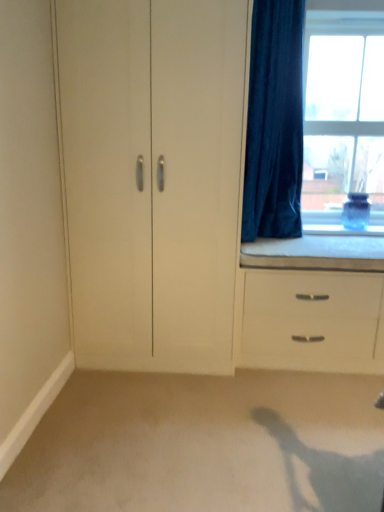
This screenshot has height=512, width=384. Identify the location of vacant region in front of white matte cabinet at center. (158, 416).